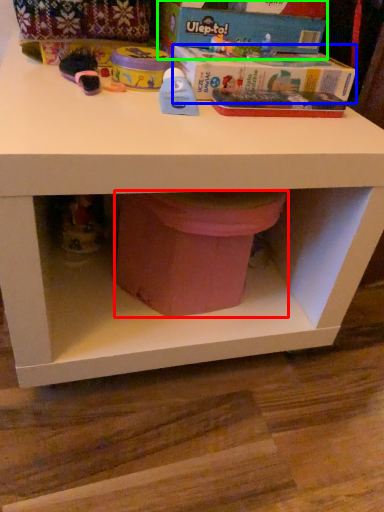
Question: Considering the real-world distances, which object is farthest from potty (highlighted by a red box)? box (highlighted by a blue box) or box (highlighted by a green box)?

Choices:
 (A) box
 (B) box

Answer: (B)